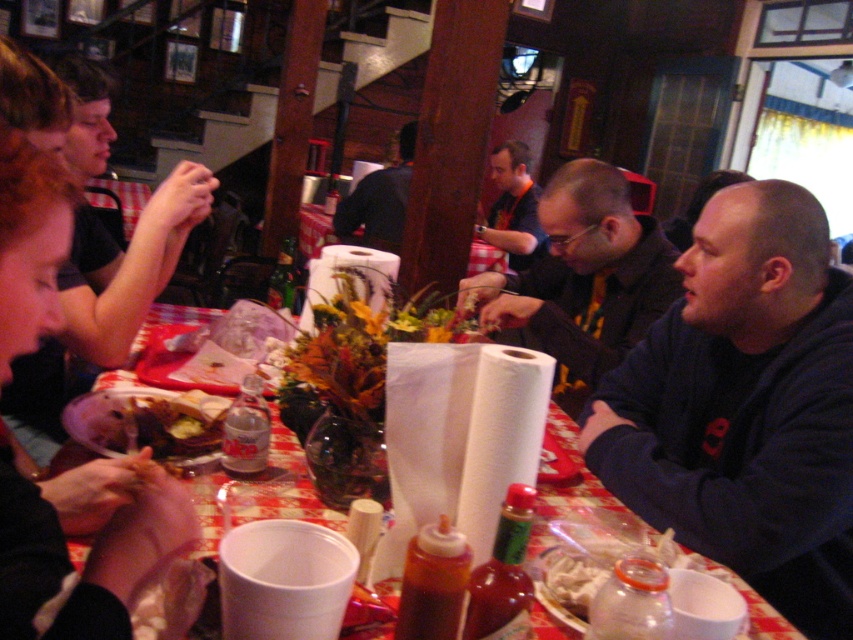
Is matte black shirt at center positioned before red checkered tablecloth at center?

No, it is behind red checkered tablecloth at center.

Who is taller, matte black shirt at center or red checkered tablecloth at center?

matte black shirt at center

Which is behind, point (579, 262) or point (224, 474)?

Positioned behind is point (579, 262).

The height and width of the screenshot is (640, 853). I want to click on matte black shirt at center, so click(583, 280).

Who is more distant from viewer, (782, 365) or (619, 202)?

Positioned behind is point (619, 202).

Does dark blue sweatshirt at right have a greater height compared to matte black shirt at center?

Yes.

Between point (802, 224) and point (607, 225), which one is positioned behind?

The point (607, 225) is more distant.

Identify the location of dark blue sweatshirt at right. This screenshot has height=640, width=853. (746, 406).

Does red checkered tablecloth at center appear on the left side of dark blue sweater at center?

No, red checkered tablecloth at center is not to the left of dark blue sweater at center.

Between red checkered tablecloth at center and dark blue sweater at center, which one has less height?

red checkered tablecloth at center is shorter.

Is point (335, 525) positioned in front of point (366, 205)?

Yes, it is in front of point (366, 205).

Where is `red checkered tablecloth at center`? The image size is (853, 640). red checkered tablecloth at center is located at coordinates (283, 490).